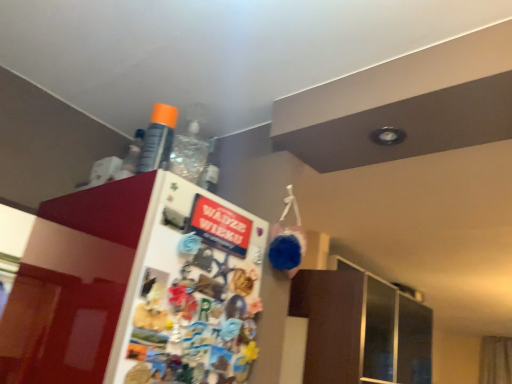
What are the coordinates of `orange matte spray can at upper center` in the screenshot? It's located at (158, 139).

What is the approximate width of orange matte spray can at upper center?

It is 1.96 inches.

The width and height of the screenshot is (512, 384). What do you see at coordinates (158, 139) in the screenshot?
I see `orange matte spray can at upper center` at bounding box center [158, 139].

Image resolution: width=512 pixels, height=384 pixels. What do you see at coordinates (176, 277) in the screenshot?
I see `white glossy fridge at upper left` at bounding box center [176, 277].

Image resolution: width=512 pixels, height=384 pixels. In order to click on white glossy fridge at upper left in this screenshot , I will do `click(176, 277)`.

Where is `orange matte spray can at upper center`? The width and height of the screenshot is (512, 384). orange matte spray can at upper center is located at coordinates (158, 139).

In the scene shown: Visually, is orange matte spray can at upper center positioned to the left or to the right of white glossy fridge at upper left?

Based on their positions, orange matte spray can at upper center is located to the left of white glossy fridge at upper left.

Which object is further away from the camera, orange matte spray can at upper center or white glossy fridge at upper left?

orange matte spray can at upper center is further away from the camera.

Which is closer, (157, 162) or (114, 363)?

Positioned in front is point (114, 363).

From the image's perspective, is orange matte spray can at upper center beneath white glossy fridge at upper left?

Incorrect, from the image's perspective, orange matte spray can at upper center is higher than white glossy fridge at upper left.

From a real-world perspective, is orange matte spray can at upper center located higher than white glossy fridge at upper left?

Indeed, from a real-world perspective, orange matte spray can at upper center stands above white glossy fridge at upper left.

Can you confirm if orange matte spray can at upper center is thinner than white glossy fridge at upper left?

In fact, orange matte spray can at upper center might be wider than white glossy fridge at upper left.

Is orange matte spray can at upper center shorter than white glossy fridge at upper left?

Correct, orange matte spray can at upper center is not as tall as white glossy fridge at upper left.

Looking at the image, does orange matte spray can at upper center seem bigger or smaller compared to white glossy fridge at upper left?

orange matte spray can at upper center is smaller than white glossy fridge at upper left.

Is orange matte spray can at upper center inside or outside of white glossy fridge at upper left?

orange matte spray can at upper center cannot be found inside white glossy fridge at upper left.

Is orange matte spray can at upper center next to white glossy fridge at upper left and touching it?

There is a gap between orange matte spray can at upper center and white glossy fridge at upper left.

Is orange matte spray can at upper center oriented away from white glossy fridge at upper left?

No, orange matte spray can at upper center's orientation is not away from white glossy fridge at upper left.

Image resolution: width=512 pixels, height=384 pixels. Identify the location of bottle that appears on the left of white glossy fridge at upper left. click(158, 139).

Considering the relative positions of white glossy fridge at upper left and orange matte spray can at upper center in the image provided, is white glossy fridge at upper left to the left of orange matte spray can at upper center from the viewer's perspective?

No.

Does white glossy fridge at upper left lie in front of orange matte spray can at upper center?

Yes, the depth of white glossy fridge at upper left is less than that of orange matte spray can at upper center.

Is point (262, 226) closer to viewer compared to point (166, 127)?

No, (262, 226) is behind (166, 127).

From the image's perspective, is white glossy fridge at upper left over orange matte spray can at upper center?

No.

From a real-world perspective, is white glossy fridge at upper left above or below orange matte spray can at upper center?

white glossy fridge at upper left is below orange matte spray can at upper center.

Which of these two, white glossy fridge at upper left or orange matte spray can at upper center, is wider?

Wider between the two is orange matte spray can at upper center.

Considering the sizes of objects white glossy fridge at upper left and orange matte spray can at upper center in the image provided, who is taller, white glossy fridge at upper left or orange matte spray can at upper center?

Standing taller between the two is white glossy fridge at upper left.

Can you confirm if white glossy fridge at upper left is smaller than orange matte spray can at upper center?

No.

Which is correct: white glossy fridge at upper left is inside orange matte spray can at upper center, or outside of it?

white glossy fridge at upper left lies outside orange matte spray can at upper center.

Is white glossy fridge at upper left beside orange matte spray can at upper center?

white glossy fridge at upper left is not next to orange matte spray can at upper center, and they're not touching.

Could you tell me if white glossy fridge at upper left is turned towards orange matte spray can at upper center?

No, white glossy fridge at upper left is not facing towards orange matte spray can at upper center.

The width and height of the screenshot is (512, 384). I want to click on bottle behind the white glossy fridge at upper left, so click(158, 139).

Where is `fridge in front of the orange matte spray can at upper center`? Image resolution: width=512 pixels, height=384 pixels. fridge in front of the orange matte spray can at upper center is located at coordinates (176, 277).

Locate an element on the screen. This screenshot has height=384, width=512. bottle behind the white glossy fridge at upper left is located at coordinates (158, 139).